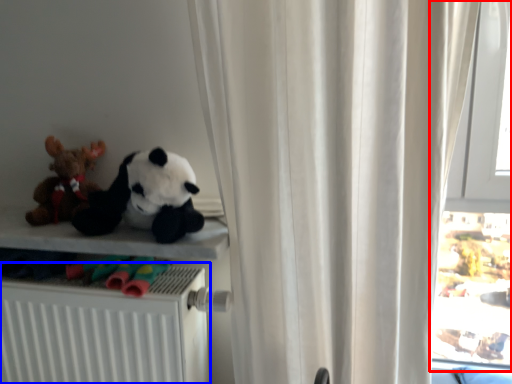
Question: Among these objects, which one is nearest to the camera, window (highlighted by a red box) or radiator (highlighted by a blue box)?

Choices:
 (A) window
 (B) radiator

Answer: (B)